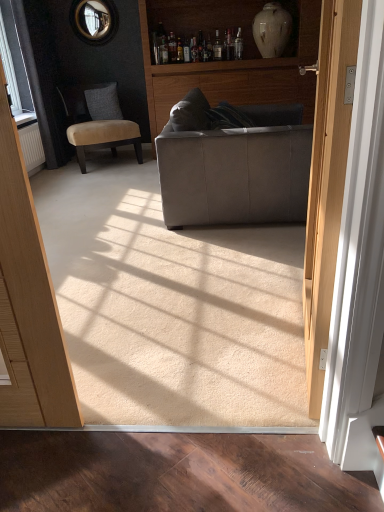
Question: Is white glossy vase at upper center not inside velvet beige chair at left?

Choices:
 (A) yes
 (B) no

Answer: (A)

Question: Is white glossy vase at upper center smaller than velvet beige chair at left?

Choices:
 (A) no
 (B) yes

Answer: (B)

Question: Can velvet beige chair at left be found inside white glossy vase at upper center?

Choices:
 (A) no
 (B) yes

Answer: (A)

Question: Does white glossy vase at upper center come in front of velvet beige chair at left?

Choices:
 (A) no
 (B) yes

Answer: (A)

Question: Is white glossy vase at upper center with velvet beige chair at left?

Choices:
 (A) yes
 (B) no

Answer: (B)

Question: Considering the positions of suede-like gray pillow at left and matte gray couch at center in the image, is suede-like gray pillow at left taller or shorter than matte gray couch at center?

Choices:
 (A) tall
 (B) short

Answer: (B)

Question: Is suede-like gray pillow at left bigger or smaller than matte gray couch at center?

Choices:
 (A) small
 (B) big

Answer: (A)

Question: Looking at their shapes, would you say suede-like gray pillow at left is wider or thinner than matte gray couch at center?

Choices:
 (A) wide
 (B) thin

Answer: (B)

Question: Is point (104, 108) closer or farther from the camera than point (286, 96)?

Choices:
 (A) farther
 (B) closer

Answer: (A)

Question: Considering the positions of point (173, 144) and point (104, 88), is point (173, 144) closer or farther from the camera than point (104, 88)?

Choices:
 (A) farther
 (B) closer

Answer: (B)

Question: Is suede gray couch at center inside or outside of velvet beige chair at left?

Choices:
 (A) outside
 (B) inside

Answer: (A)

Question: Based on their positions, is suede gray couch at center located to the left or right of velvet beige chair at left?

Choices:
 (A) left
 (B) right

Answer: (B)

Question: Relative to velvet beige chair at left, is suede gray couch at center in front or behind?

Choices:
 (A) front
 (B) behind

Answer: (A)

Question: Relative to matte gray couch at center, is suede gray couch at center in front or behind?

Choices:
 (A) front
 (B) behind

Answer: (A)

Question: Considering the positions of suede gray couch at center and matte gray couch at center in the image, is suede gray couch at center wider or thinner than matte gray couch at center?

Choices:
 (A) wide
 (B) thin

Answer: (A)